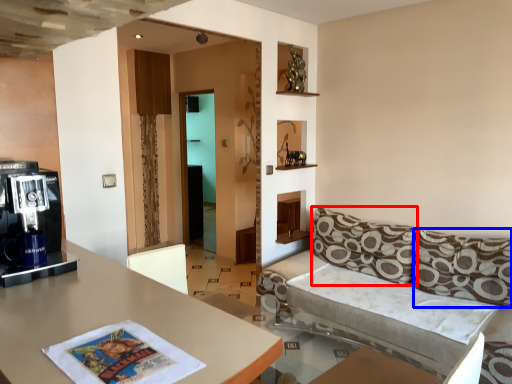
Question: Among these objects, which one is farthest to the camera, pillow (highlighted by a red box) or pillow (highlighted by a blue box)?

Choices:
 (A) pillow
 (B) pillow

Answer: (A)